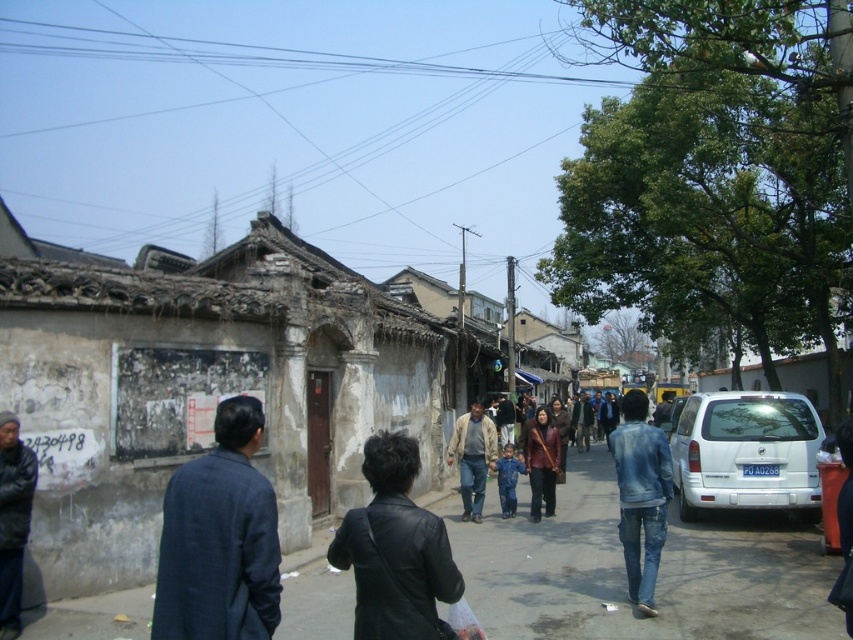
You are standing on the street and see the dark gray concrete alley at center and the dark blue jacket at lower left. Which object is located to the right of the other?

The dark gray concrete alley at center is positioned on the right side of dark blue jacket at lower left.